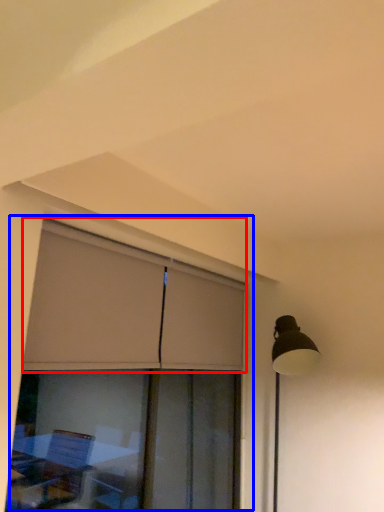
Question: Which object is closer to the camera taking this photo, curtain (highlighted by a red box) or window (highlighted by a blue box)?

Choices:
 (A) curtain
 (B) window

Answer: (B)